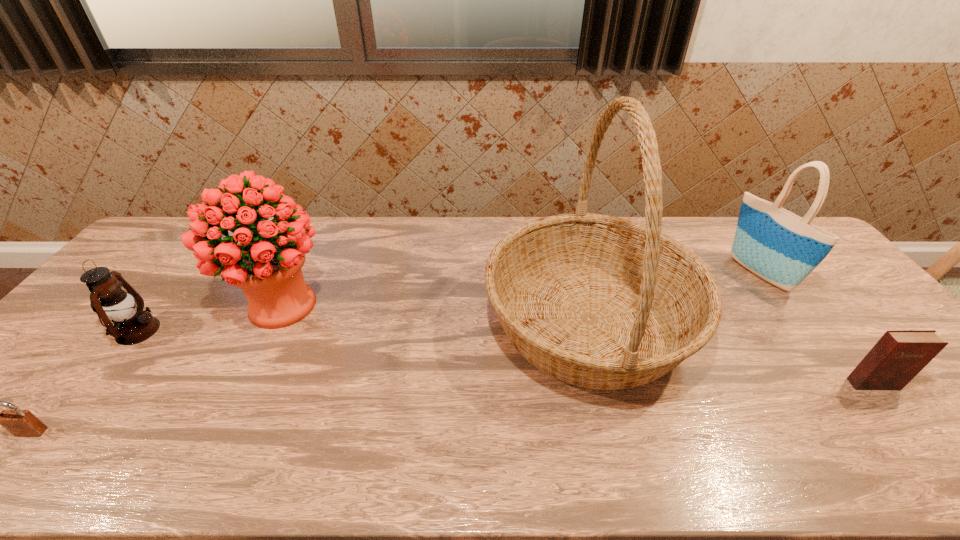
The height and width of the screenshot is (540, 960). In order to click on vacant space at the far edge of the desktop in this screenshot , I will do `click(408, 239)`.

This screenshot has width=960, height=540. In order to click on vacant space at the near edge in this screenshot , I will do `click(595, 472)`.

The height and width of the screenshot is (540, 960). What are the coordinates of `vacant space at the left edge` in the screenshot? It's located at (83, 319).

Image resolution: width=960 pixels, height=540 pixels. What are the coordinates of `vacant space at the right edge of the desktop` in the screenshot? It's located at (902, 410).

The width and height of the screenshot is (960, 540). What are the coordinates of `vacant space at the far left corner of the desktop` in the screenshot? It's located at (175, 221).

Find the location of a particular element. blank space at the near left corner is located at coordinates (37, 442).

Locate an element on the screen. This screenshot has width=960, height=540. free space that is in between the fourth tallest object and the shortest object is located at coordinates (84, 381).

The image size is (960, 540). I want to click on vacant point located between the tote bag and the padlock, so click(395, 353).

Where is `free space between the shortest object and the fourth object from right to left`? The image size is (960, 540). free space between the shortest object and the fourth object from right to left is located at coordinates (156, 369).

Identify the location of vacant space that's between the lantern and the bouquet. Image resolution: width=960 pixels, height=540 pixels. (209, 318).